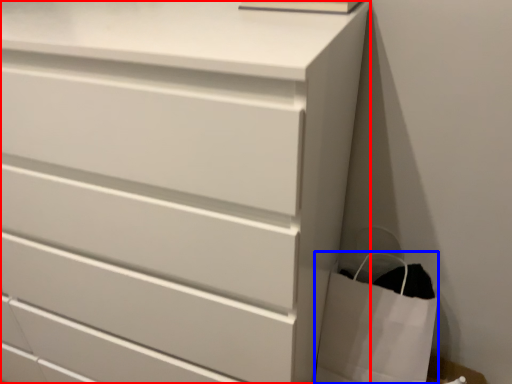
Question: Which object is further to the camera taking this photo, chest of drawers (highlighted by a red box) or bag (highlighted by a blue box)?

Choices:
 (A) chest of drawers
 (B) bag

Answer: (B)